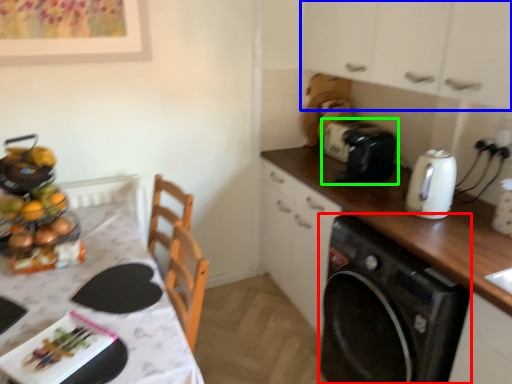
Question: Which object is positioned farthest from home appliance (highlighted by a red box)? Select from cabinetry (highlighted by a blue box) and toaster (highlighted by a green box).

Choices:
 (A) cabinetry
 (B) toaster

Answer: (A)